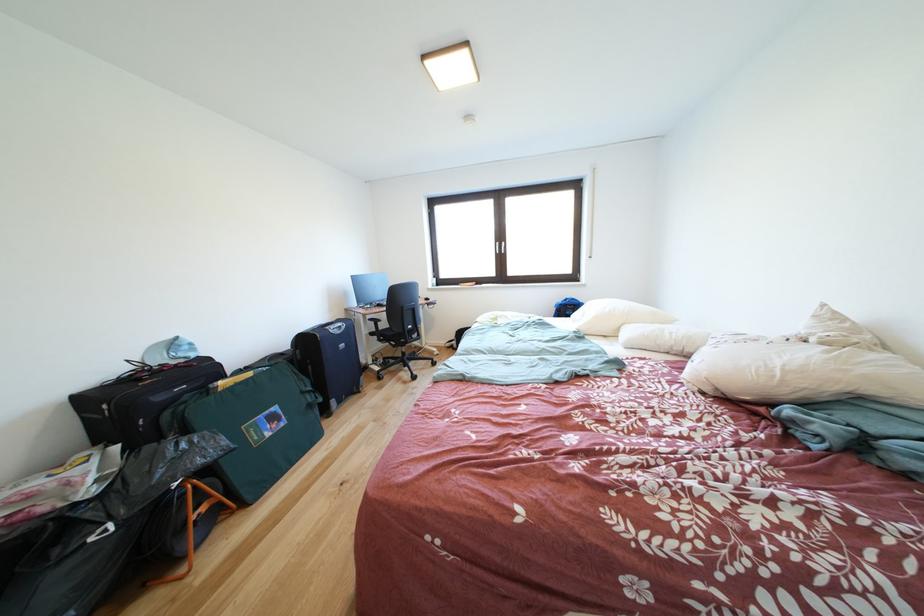
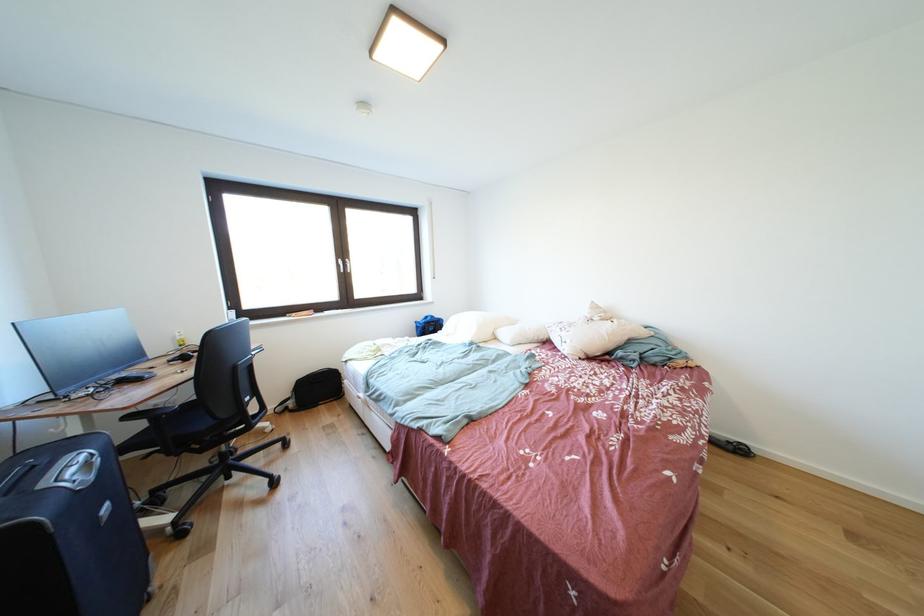
Where in the second image is the point corresponding to point 347,337 from the first image?

(101, 483)